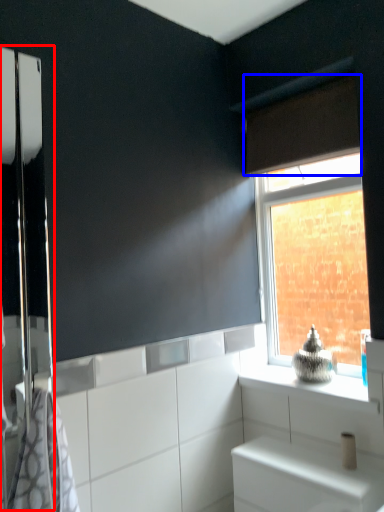
Question: Which of the following is the closest to the observer, screen door (highlighted by a red box) or curtain (highlighted by a blue box)?

Choices:
 (A) screen door
 (B) curtain

Answer: (A)